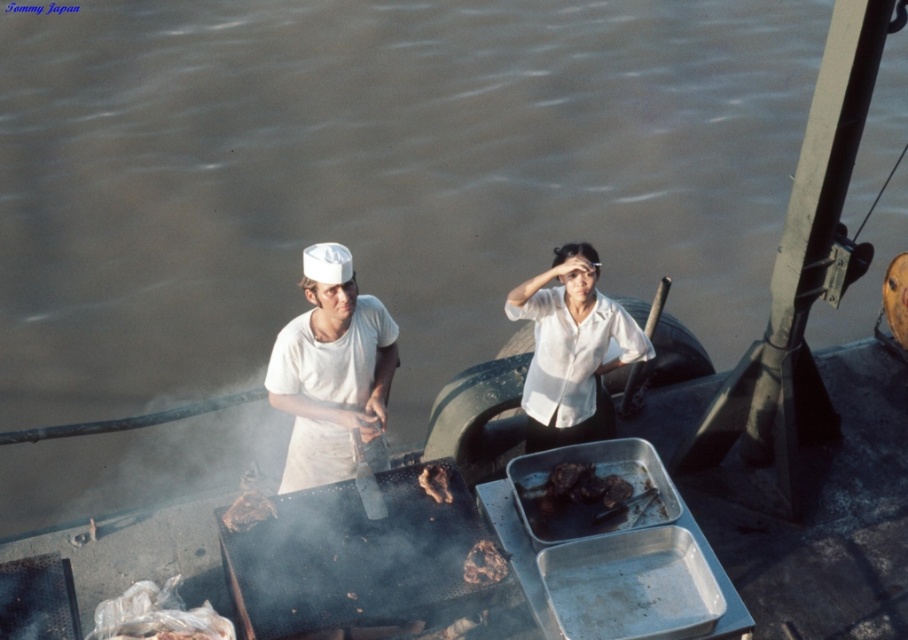
Which is in front, point (352, 410) or point (439, 486)?

Positioned in front is point (439, 486).

Between white matte shirt at center and brown crispy meat at center, which one is positioned lower?

brown crispy meat at center

Does point (332, 253) come behind point (433, 468)?

No, (332, 253) is closer to viewer.

Locate an element on the screen. Image resolution: width=908 pixels, height=640 pixels. white matte shirt at center is located at coordinates (332, 372).

Between white matte shirt at center and brown textured meat at center, which one appears on the left side from the viewer's perspective?

Positioned to the left is white matte shirt at center.

Between point (352, 403) and point (489, 577), which one is positioned behind?

The point (352, 403) is more distant.

Locate an element on the screen. This screenshot has width=908, height=640. white matte shirt at center is located at coordinates (332, 372).

Between point (629, 326) and point (448, 492), which one is positioned in front?

Point (448, 492)

Is point (514, 314) farther from viewer compared to point (420, 483)?

Yes, point (514, 314) is behind point (420, 483).

Who is more distant from viewer, [612,358] or [435,474]?

Point [612,358]

You are a GUI agent. You are given a task and a screenshot of the screen. Output one action in this format:
    pyautogui.click(x=<x>, y=<y>)
    Task: Click on the white glossy shirt at center
    The image size is (908, 640).
    Given the screenshot: What is the action you would take?
    pyautogui.click(x=571, y=349)